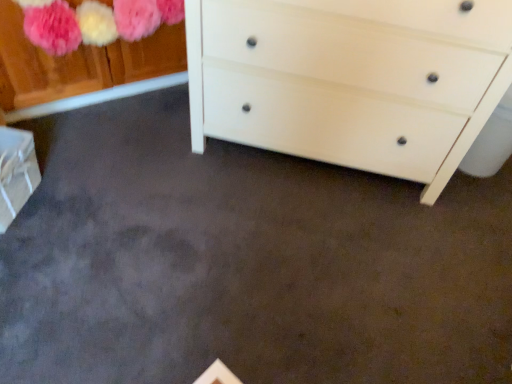
Locate an element on the screen. free point behind white cardboard box at lower left is located at coordinates (60, 144).